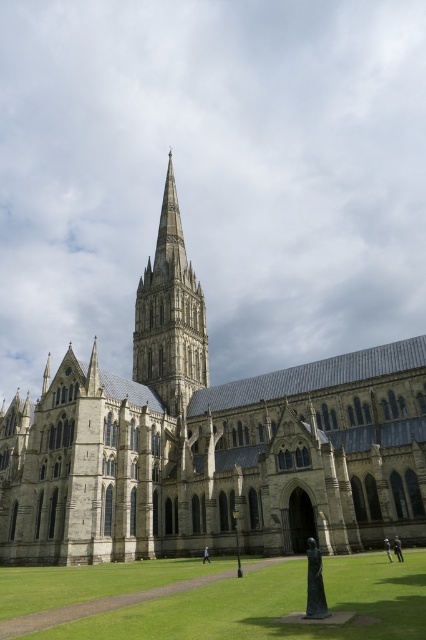
You are standing at the base of the cathedral and want to take a photo of the spire. The camera you are using has a maximum focus range of 100 feet. Will you be able to focus on the point at point (411, 588)?

The point at point (411, 588) is 111.54 feet away from the camera, which exceeds the maximum focus range of 100 feet. Therefore, the camera will not be able to focus on that point.

You are a photographer planning to capture the grandeur of the gray stone church at center and the green grass at lower center in a single shot. Considering their sizes, which object should you focus on to ensure both are visible in the frame?

The gray stone church at center is larger than the green grass at lower center, so focusing on the gray stone church at center would ensure both are visible in the frame as the church takes up more space.